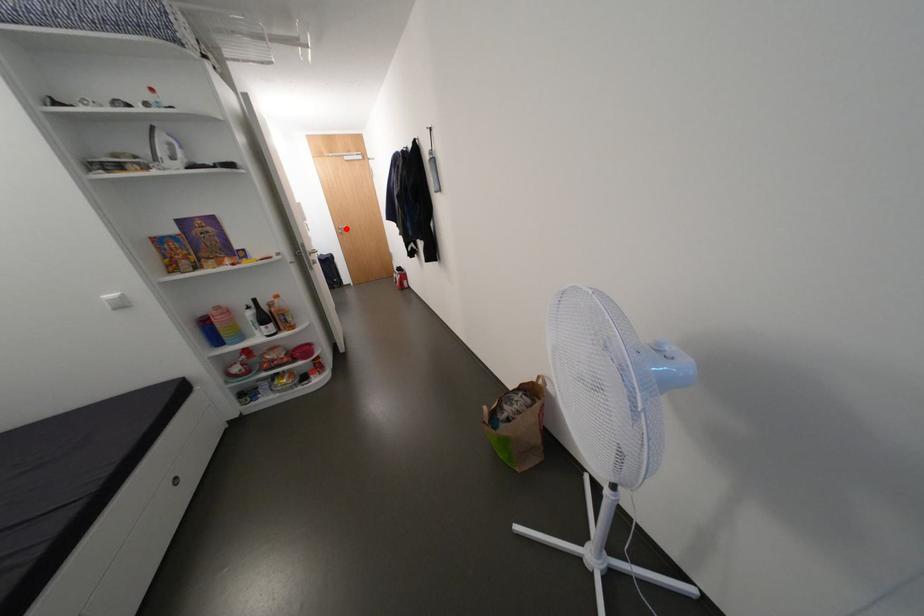
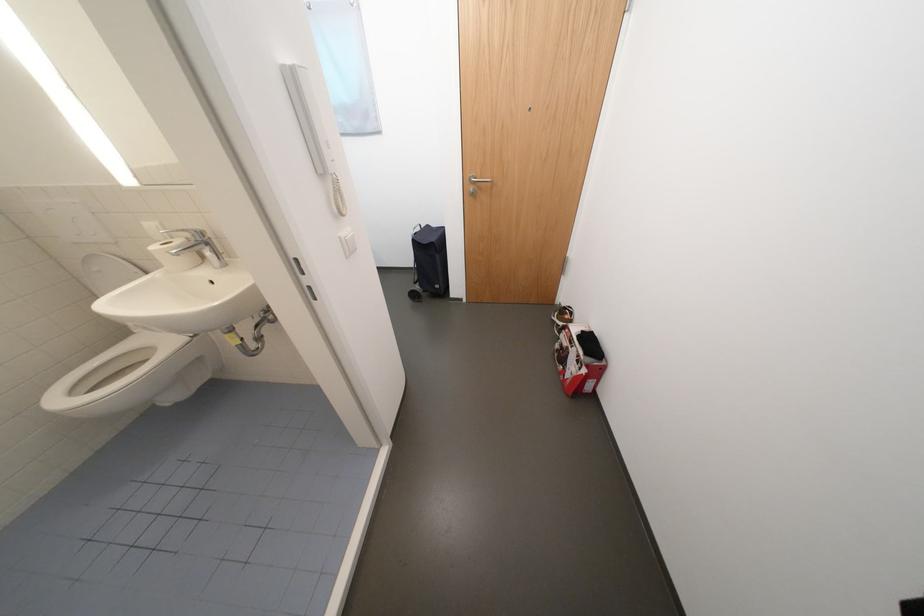
The point at the highlighted location is marked in the first image. Where is the corresponding point in the second image?

(478, 180)